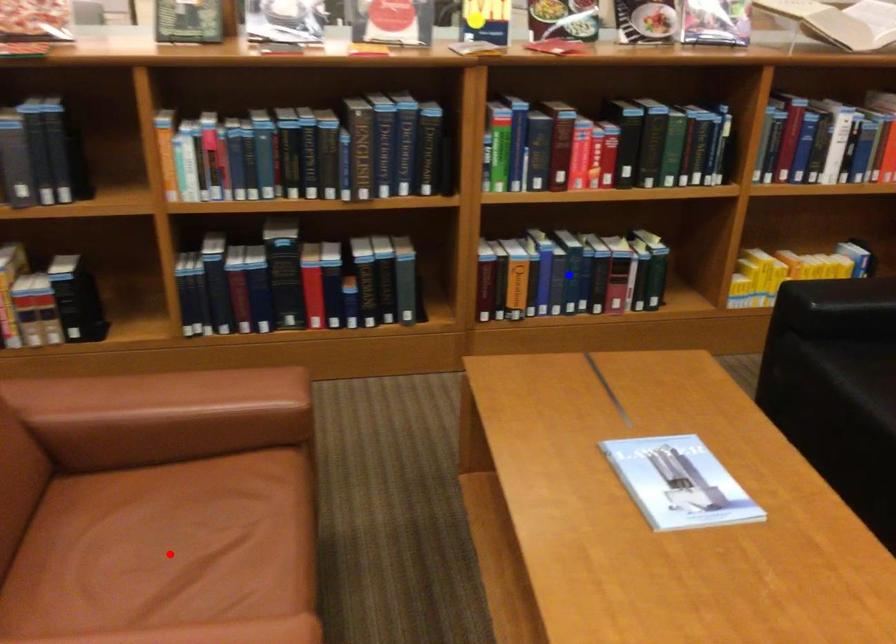
Question: Two points are marked on the image. Which point is closer to the camera?

Choices:
 (A) Blue point is closer.
 (B) Red point is closer.

Answer: (B)